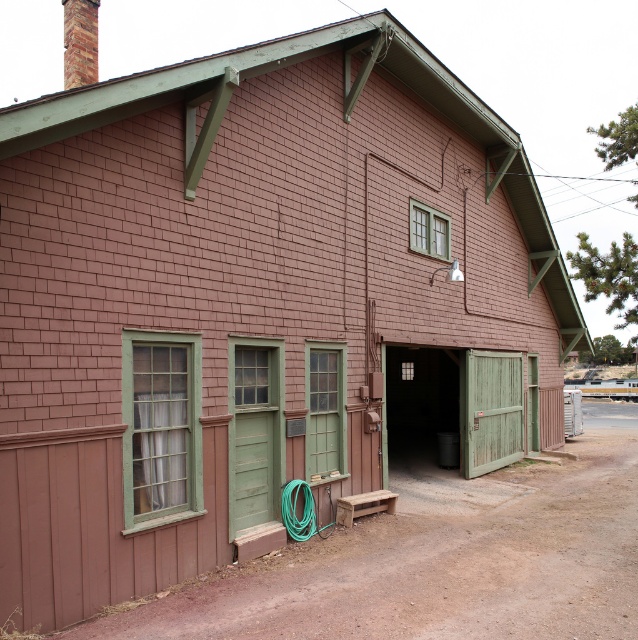
You are a delivery person trying to deliver a package to the building. The package is too large to fit through the green rubber hose at center. Can you fit it through the green wooden door at center instead?

The green wooden door at center is wider than the green rubber hose at center, so the package can fit through the green wooden door at center.